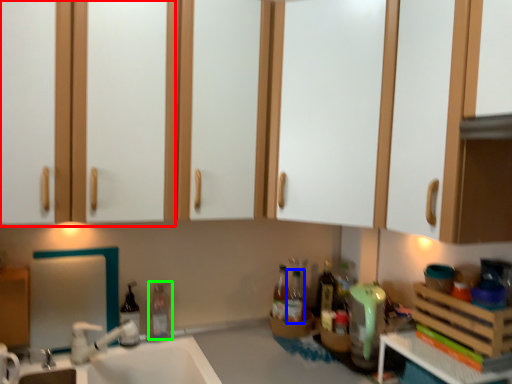
Question: Which object is the closest to the cabinetry (highlighted by a red box)? Choose among these: bottle (highlighted by a blue box) or bottle (highlighted by a green box).

Choices:
 (A) bottle
 (B) bottle

Answer: (B)